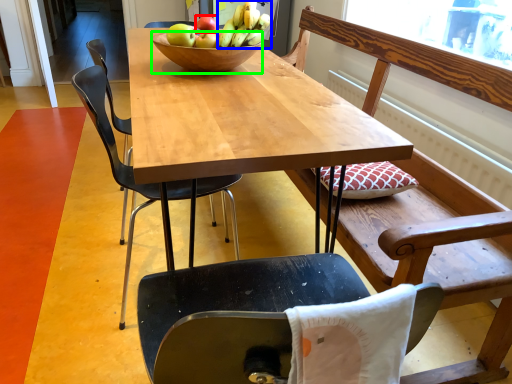
Question: Which is farther away from apple (highlighted by a red box)? banana (highlighted by a blue box) or bowl (highlighted by a green box)?

Choices:
 (A) banana
 (B) bowl

Answer: (B)